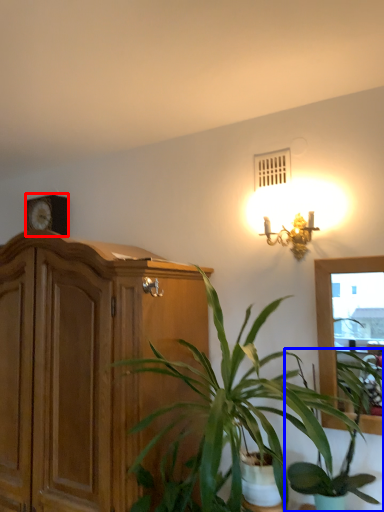
Question: Which object appears farthest to the camera in this image, clock (highlighted by a red box) or houseplant (highlighted by a blue box)?

Choices:
 (A) clock
 (B) houseplant

Answer: (A)